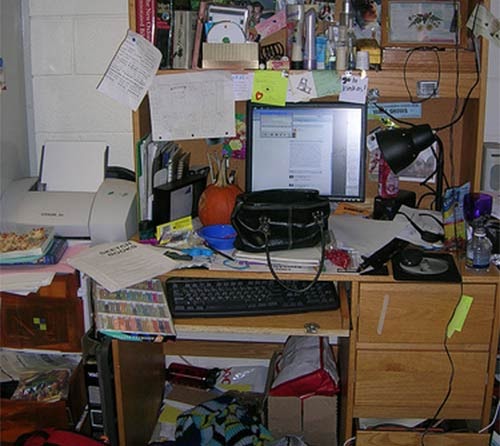
The height and width of the screenshot is (446, 500). Identify the location of mouse. (413, 256).